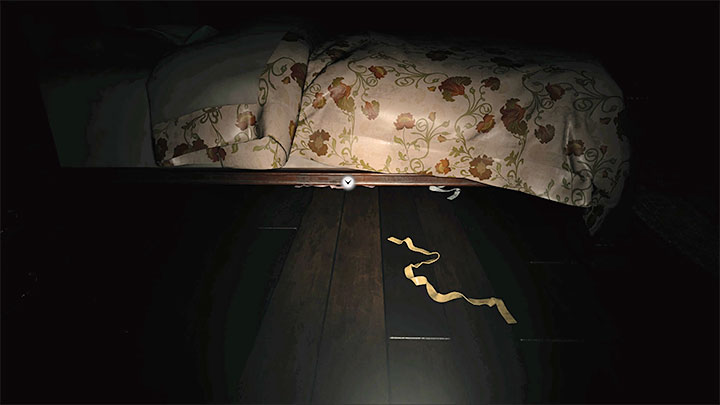
Find the location of a particular element. The height and width of the screenshot is (405, 720). bed sheet is located at coordinates (67, 110), (126, 129).